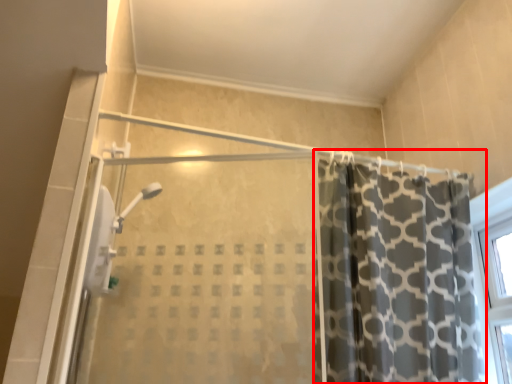
Question: Considering the relative positions of curtain (annotated by the red box) and screen door in the image provided, where is curtain (annotated by the red box) located with respect to the staircase?

Choices:
 (A) left
 (B) right

Answer: (B)